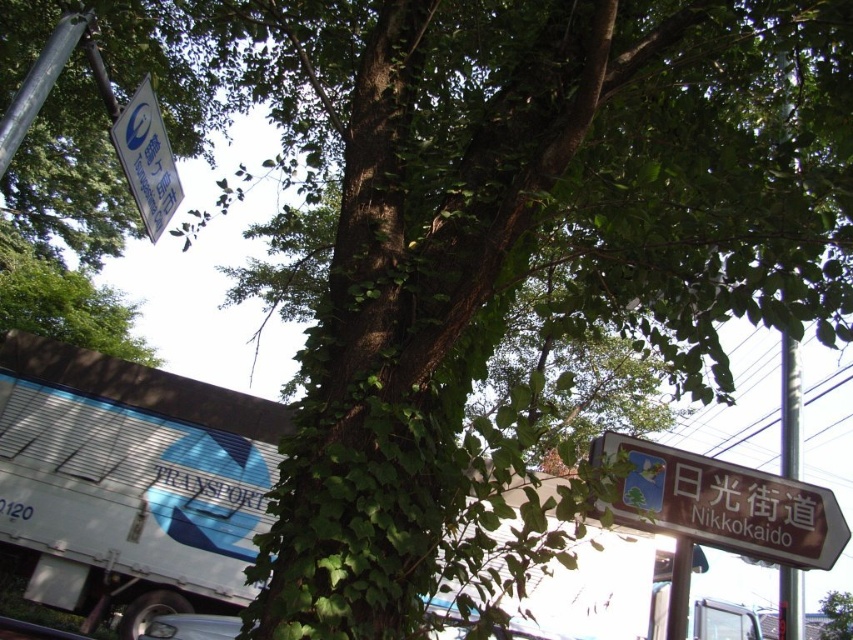
Can you confirm if white plastic sign at upper left is positioned to the left of green leafy tree at center?

Yes, white plastic sign at upper left is to the left of green leafy tree at center.

The width and height of the screenshot is (853, 640). Describe the element at coordinates (148, 160) in the screenshot. I see `white plastic sign at upper left` at that location.

Does point (132, 104) come in front of point (839, 595)?

Yes, point (132, 104) is in front of point (839, 595).

Locate an element on the screen. This screenshot has width=853, height=640. white plastic sign at upper left is located at coordinates (148, 160).

Does point (781, 550) lie behind point (154, 198)?

No, it is in front of (154, 198).

Does brown wooden sign at lower right appear on the left side of white plastic sign at upper left?

No, brown wooden sign at lower right is not to the left of white plastic sign at upper left.

Who is more distant from viewer, [804,528] or [172,208]?

The point [172,208] is behind.

You are a GUI agent. You are given a task and a screenshot of the screen. Output one action in this format:
    pyautogui.click(x=<x>, y=<y>)
    Task: Click on the brown wooden sign at lower right
    This screenshot has height=640, width=853.
    Given the screenshot: What is the action you would take?
    723,504

Is point (699, 493) positioned behind point (840, 620)?

No, it is in front of (840, 620).

Can you confirm if brown wooden sign at lower right is wider than green leafy tree at center?

Indeed, brown wooden sign at lower right has a greater width compared to green leafy tree at center.

Between point (706, 502) and point (849, 637), which one is positioned behind?

Positioned behind is point (849, 637).

You are a GUI agent. You are given a task and a screenshot of the screen. Output one action in this format:
    pyautogui.click(x=<x>, y=<y>)
    Task: Click on the brown wooden sign at lower right
    The image size is (853, 640).
    Given the screenshot: What is the action you would take?
    pyautogui.click(x=723, y=504)